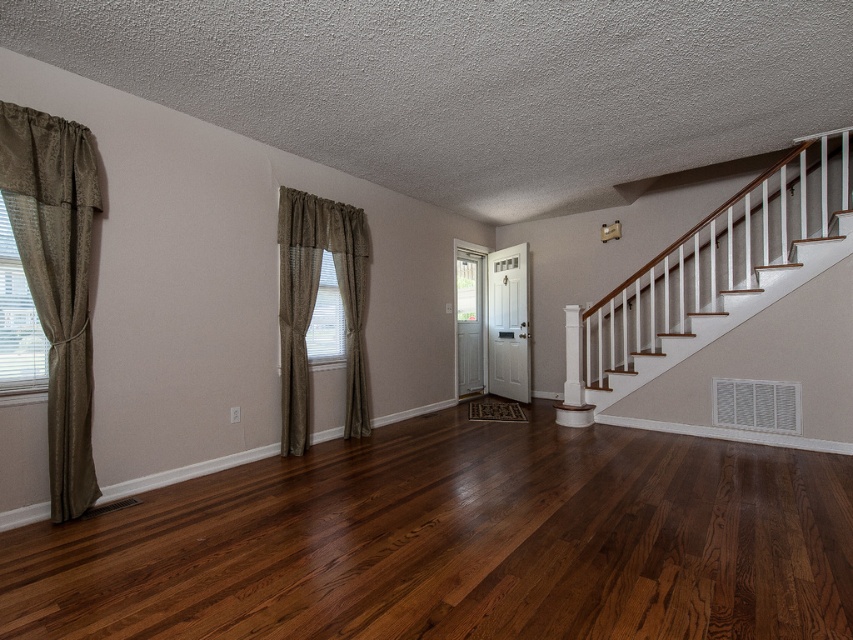
Who is lower down, dark brown wood floor at center or satin beige curtain at left?

dark brown wood floor at center

Does point (578, 598) come closer to viewer compared to point (54, 250)?

Yes, point (578, 598) is closer to viewer.

You are a GUI agent. You are given a task and a screenshot of the screen. Output one action in this format:
    pyautogui.click(x=<x>, y=<y>)
    Task: Click on the dark brown wood floor at center
    The image size is (853, 640).
    Given the screenshot: What is the action you would take?
    pyautogui.click(x=459, y=541)

Is satin beige curtain at left shorter than white textured blinds at left?

Incorrect, satin beige curtain at left's height does not fall short of white textured blinds at left's.

Who is more distant from viewer, (90, 198) or (13, 390)?

Positioned behind is point (90, 198).

Between point (71, 305) and point (12, 310), which one is positioned in front?

Point (12, 310)

The width and height of the screenshot is (853, 640). What are the coordinates of `satin beige curtain at left` in the screenshot? It's located at (56, 278).

Is dark brown wood floor at center below matte beige curtain at center left?

Yes, dark brown wood floor at center is below matte beige curtain at center left.

Image resolution: width=853 pixels, height=640 pixels. In order to click on dark brown wood floor at center in this screenshot , I will do `click(459, 541)`.

The height and width of the screenshot is (640, 853). Identify the location of dark brown wood floor at center. (459, 541).